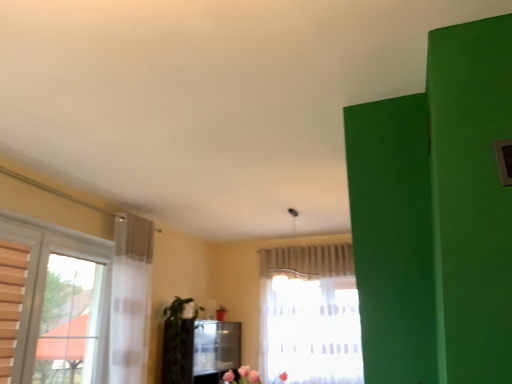
Question: Considering the relative sizes of white sheer curtain at center and green matte plant at lower left in the image provided, is white sheer curtain at center shorter than green matte plant at lower left?

Choices:
 (A) yes
 (B) no

Answer: (A)

Question: Are white sheer curtain at center and green matte plant at lower left beside each other?

Choices:
 (A) yes
 (B) no

Answer: (B)

Question: Is white sheer curtain at center positioned far away from green matte plant at lower left?

Choices:
 (A) yes
 (B) no

Answer: (A)

Question: Could you tell me if white sheer curtain at center is facing green matte plant at lower left?

Choices:
 (A) yes
 (B) no

Answer: (B)

Question: Can you confirm if white sheer curtain at center is positioned to the left of green matte plant at lower left?

Choices:
 (A) no
 (B) yes

Answer: (A)

Question: From the image's perspective, is white sheer curtain at center beneath green matte plant at lower left?

Choices:
 (A) no
 (B) yes

Answer: (A)

Question: Is green matte plant at lower left wider than white sheer curtain at center?

Choices:
 (A) yes
 (B) no

Answer: (A)

Question: Is green matte plant at lower left beside white sheer curtain at center?

Choices:
 (A) no
 (B) yes

Answer: (A)

Question: Could white sheer curtain at center be considered to be inside green matte plant at lower left?

Choices:
 (A) no
 (B) yes

Answer: (A)

Question: From a real-world perspective, is green matte plant at lower left below white sheer curtain at center?

Choices:
 (A) yes
 (B) no

Answer: (A)

Question: Is green matte plant at lower left at the left side of white sheer curtain at center?

Choices:
 (A) no
 (B) yes

Answer: (B)

Question: From the image's perspective, does green matte plant at lower left appear lower than white sheer curtain at center?

Choices:
 (A) no
 (B) yes

Answer: (B)

Question: From a real-world perspective, is white sheer curtain at center positioned above or below green matte plant at lower left?

Choices:
 (A) below
 (B) above

Answer: (B)